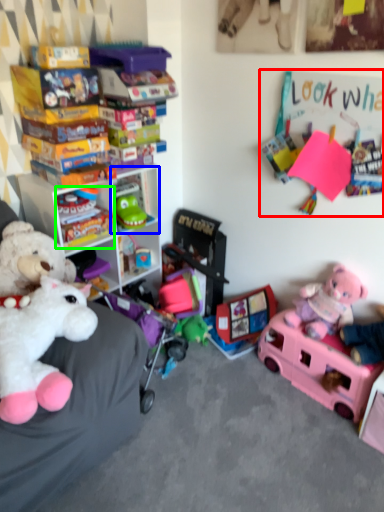
Question: Considering the real-world distances, which object is closest to bulletin board (highlighted by a red box)? shelf (highlighted by a blue box) or toy (highlighted by a green box).

Choices:
 (A) shelf
 (B) toy

Answer: (A)